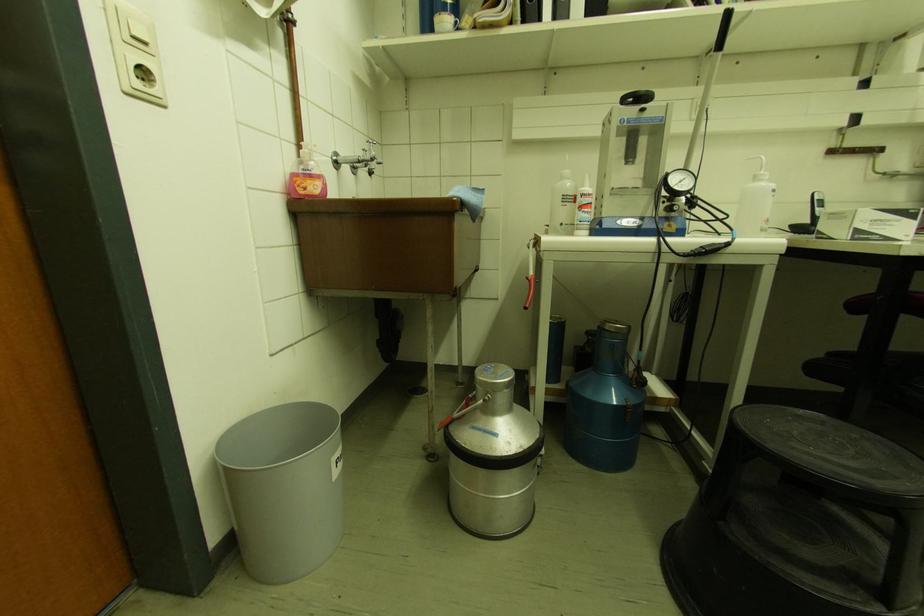
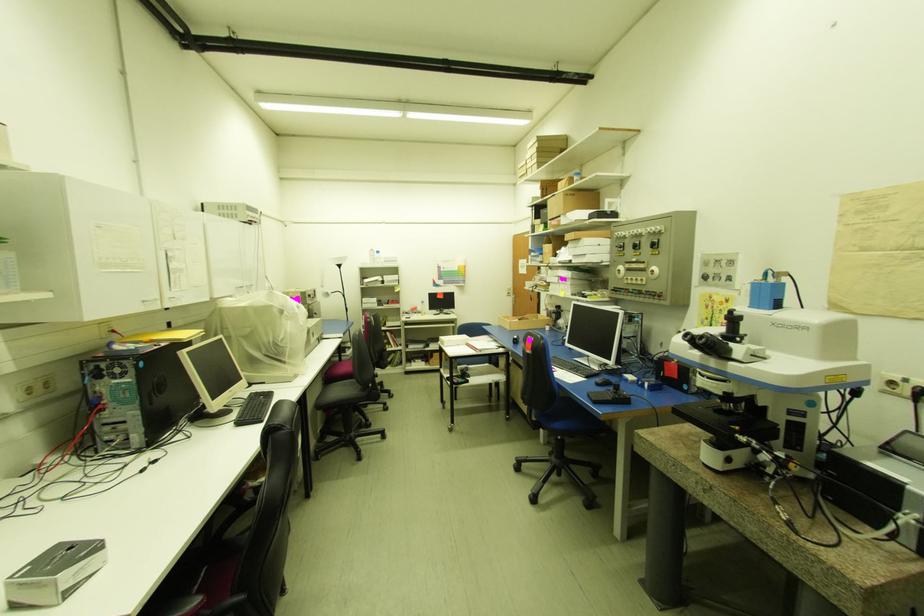
Question: Based on the continuous images, in which direction is the camera rotating? Reply with the corresponding letter.

Choices:
 (A) Left
 (B) Right
 (C) Up
 (D) Down

Answer: (B)